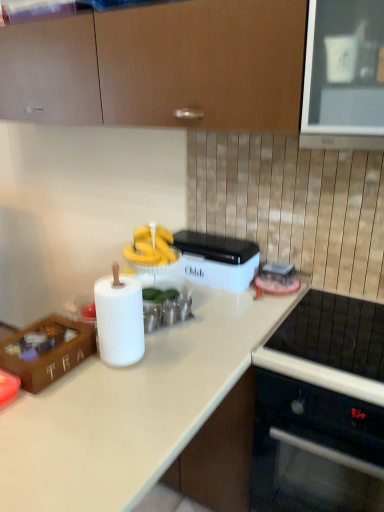
This screenshot has height=512, width=384. What are the coordinates of `black glass cooktop at lower right` in the screenshot? It's located at (321, 409).

I want to click on matte wood cabinets at upper center, so click(x=159, y=66).

At what (x,y) coordinates should I click in order to perform the action: click on white matte countertop at center. Please return your answer as a coordinate pair (x, y). Looking at the image, I should click on (129, 410).

Where is `black glass cooktop at lower right`? The height and width of the screenshot is (512, 384). black glass cooktop at lower right is located at coordinates (321, 409).

Is white matte countertop at center thinner than black glass cooktop at lower right?

No.

Is point (183, 345) closer or farther from the camera than point (301, 493)?

Point (183, 345) is closer to the camera than point (301, 493).

Measure the distance from white matte countertop at center to black glass cooktop at lower right.

white matte countertop at center and black glass cooktop at lower right are 13.50 inches apart.

Which of these two, white matte countertop at center or matte wood cabinets at upper center, is thinner?

With smaller width is white matte countertop at center.

From a real-world perspective, is white matte countertop at center physically located above or below matte wood cabinets at upper center?

From a real-world perspective, white matte countertop at center is physically below matte wood cabinets at upper center.

Is white matte countertop at center surrounding matte wood cabinets at upper center?

No.

Is white matte countertop at center looking in the opposite direction of white plastic container at center?

Correct, white matte countertop at center is looking away from white plastic container at center.

Considering the relative sizes of white matte countertop at center and white plastic container at center in the image provided, is white matte countertop at center bigger than white plastic container at center?

Indeed, white matte countertop at center has a larger size compared to white plastic container at center.

Is white matte countertop at center further to the viewer compared to white plastic container at center?

No, the depth of white matte countertop at center is less than that of white plastic container at center.

Does white matte countertop at center have a greater width compared to white plastic container at center?

Yes, white matte countertop at center is wider than white plastic container at center.

From the image's perspective, is white plastic container at center positioned above or below white matte countertop at center?

white plastic container at center is above white matte countertop at center.

Is white plastic container at center with white matte countertop at center?

white plastic container at center and white matte countertop at center are not in contact.

Based on their sizes in the image, would you say white plastic container at center is bigger or smaller than white matte countertop at center?

Clearly, white plastic container at center is smaller in size than white matte countertop at center.

Considering the sizes of objects white plastic container at center and white matte countertop at center in the image provided, who is thinner, white plastic container at center or white matte countertop at center?

white plastic container at center is thinner.

Is wooden tea box at lower left directly adjacent to white matte countertop at center?

They are not placed beside each other.

From a real-world perspective, between wooden tea box at lower left and white matte countertop at center, who is vertically higher?

wooden tea box at lower left, from a real-world perspective.

Looking at this image, from the image's perspective, which one is positioned higher, wooden tea box at lower left or white matte countertop at center?

wooden tea box at lower left, from the image's perspective.

Is wooden tea box at lower left positioned beyond the bounds of white matte countertop at center?

Absolutely, wooden tea box at lower left is external to white matte countertop at center.

Who is taller, wooden tea box at lower left or matte wood cabinets at upper center?

With more height is matte wood cabinets at upper center.

Is point (45, 360) positioned in front of point (88, 34)?

Yes.

From a real-world perspective, is wooden tea box at lower left positioned above or below matte wood cabinets at upper center?

wooden tea box at lower left is situated lower than matte wood cabinets at upper center in the real world.

Does wooden tea box at lower left have a greater width compared to matte wood cabinets at upper center?

In fact, wooden tea box at lower left might be narrower than matte wood cabinets at upper center.

Based on the photo, is matte wood cabinets at upper center situated inside white plastic container at center or outside?

matte wood cabinets at upper center is located beyond the bounds of white plastic container at center.

Looking at this image, what's the angular difference between matte wood cabinets at upper center and white plastic container at center's facing directions?

The angular difference between matte wood cabinets at upper center and white plastic container at center is 90 degrees.

Is matte wood cabinets at upper center beside white plastic container at center?

matte wood cabinets at upper center and white plastic container at center are clearly separated.

I want to click on home appliance above the white matte countertop at center (from a real-world perspective), so click(x=321, y=409).

The height and width of the screenshot is (512, 384). Identify the location of countertop on the left of matte wood cabinets at upper center. (129, 410).

Looking at the image, which one is located closer to white matte countertop at center, white plastic container at center or wooden tea box at lower left?

Based on the image, wooden tea box at lower left appears to be nearer to white matte countertop at center.

Considering their positions, is matte wood cabinets at upper center positioned further to black glass cooktop at lower right than white matte countertop at center?

Based on the image, matte wood cabinets at upper center appears to be further to black glass cooktop at lower right.

Based on their spatial positions, is matte wood cabinets at upper center or white plastic container at center further from wooden tea box at lower left?

matte wood cabinets at upper center.

Based on their spatial positions, is black glass cooktop at lower right or matte wood cabinets at upper center further from wooden tea box at lower left?

matte wood cabinets at upper center lies further to wooden tea box at lower left than the other object.

Estimate the real-world distances between objects in this image. Which object is further from black glass cooktop at lower right, matte wood cabinets at upper center or wooden tea box at lower left?

matte wood cabinets at upper center.

Based on their spatial positions, is wooden tea box at lower left or matte wood cabinets at upper center further from black glass cooktop at lower right?

matte wood cabinets at upper center is positioned further to the anchor black glass cooktop at lower right.

From the image, which object appears to be nearer to white plastic container at center, matte wood cabinets at upper center or white matte countertop at center?

Based on the image, white matte countertop at center appears to be nearer to white plastic container at center.

Looking at the image, which one is located closer to wooden tea box at lower left, matte wood cabinets at upper center or white matte countertop at center?

The object closer to wooden tea box at lower left is white matte countertop at center.

You are a GUI agent. You are given a task and a screenshot of the screen. Output one action in this format:
    pyautogui.click(x=<x>, y=<y>)
    Task: Click on the home appliance between matte wood cabinets at upper center and white matte countertop at center in the up-down direction
    
    Given the screenshot: What is the action you would take?
    pyautogui.click(x=321, y=409)

Find the location of a particular element. appliance between matte wood cabinets at upper center and white matte countertop at center in the vertical direction is located at coordinates (217, 260).

Where is `home appliance positioned between white matte countertop at center and white plastic container at center from near to far`? Image resolution: width=384 pixels, height=512 pixels. home appliance positioned between white matte countertop at center and white plastic container at center from near to far is located at coordinates (321, 409).

Identify the location of countertop between wooden tea box at lower left and black glass cooktop at lower right from left to right. (129, 410).